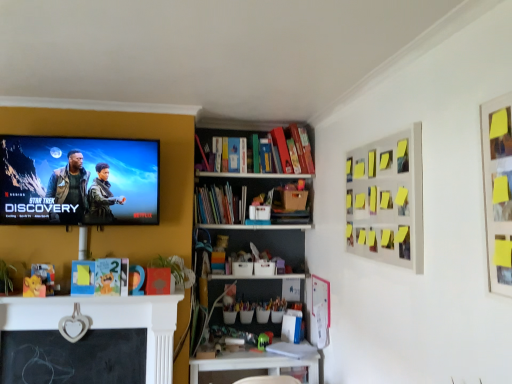
Question: Is white plastic table at lower center wider or thinner than green plastic toy at lower center?

Choices:
 (A) thin
 (B) wide

Answer: (B)

Question: From their relative heights in the image, would you say white plastic table at lower center is taller or shorter than green plastic toy at lower center?

Choices:
 (A) tall
 (B) short

Answer: (A)

Question: Which of these objects is positioned farthest from the matte black screen at upper left?

Choices:
 (A) hardcover book at center
 (B) white plastic table at lower center
 (C) green plastic toy at lower center
 (D) yellow sticky notes at upper right

Answer: (C)

Question: Considering the real-world distances, which object is closest to the hardcover book at center?

Choices:
 (A) matte black screen at upper left
 (B) yellow sticky notes at upper right
 (C) green plastic toy at lower center
 (D) white plastic table at lower center

Answer: (A)